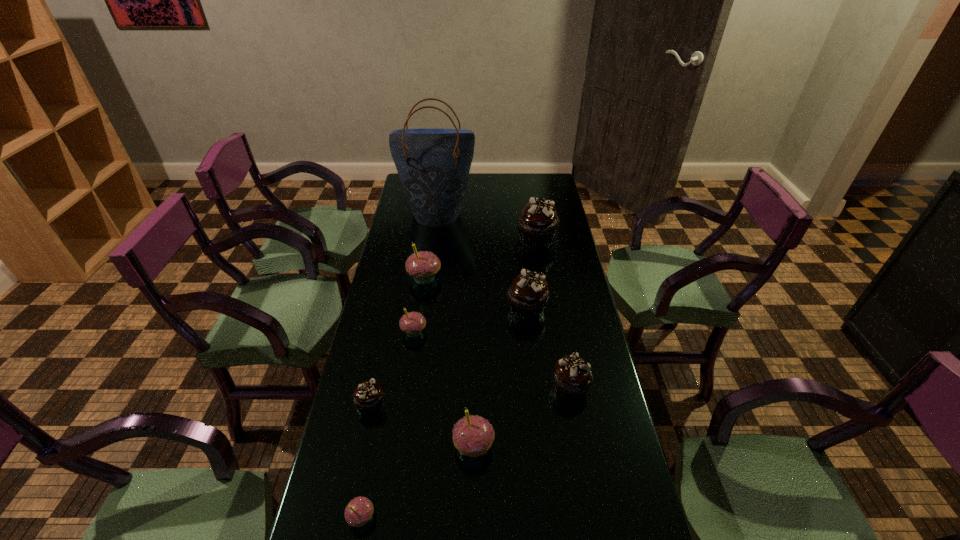
The height and width of the screenshot is (540, 960). What are the coordinates of `free spot between the shopping bag and the third farthest object` in the screenshot? It's located at (431, 246).

In order to click on empty space that is in between the nearest pink cupcake and the third farthest pink cupcake in this screenshot , I will do `click(418, 482)`.

Find the location of a particular element. Image resolution: width=960 pixels, height=540 pixels. vacant point located between the smallest brown cupcake and the third farthest object is located at coordinates (397, 341).

Image resolution: width=960 pixels, height=540 pixels. Find the location of `empty location between the farthest brown cupcake and the blue shopping bag`. empty location between the farthest brown cupcake and the blue shopping bag is located at coordinates (487, 226).

Locate an element on the screen. unoccupied area between the third nearest brown cupcake and the farthest object is located at coordinates (482, 261).

Locate which object is the fifth closest to the second farthest pink cupcake. Please provide its 2D coordinates. Your answer should be formatted as a tuple, i.e. [(x, y)], where the tuple contains the x and y coordinates of a point satisfying the conditions above.

[(572, 378)]

Where is `object that is the fourth closest to the farthest brown cupcake`? This screenshot has width=960, height=540. object that is the fourth closest to the farthest brown cupcake is located at coordinates (412, 323).

The height and width of the screenshot is (540, 960). Find the location of `cupcake that is the second closest to the third biggest brown cupcake`. cupcake that is the second closest to the third biggest brown cupcake is located at coordinates (528, 294).

The width and height of the screenshot is (960, 540). In order to click on the fourth closest cupcake to the second smallest brown cupcake in this screenshot , I will do `click(367, 397)`.

Select which brown cupcake appears as the third closest to the shopping bag. Please provide its 2D coordinates. Your answer should be formatted as a tuple, i.e. [(x, y)], where the tuple contains the x and y coordinates of a point satisfying the conditions above.

[(572, 378)]